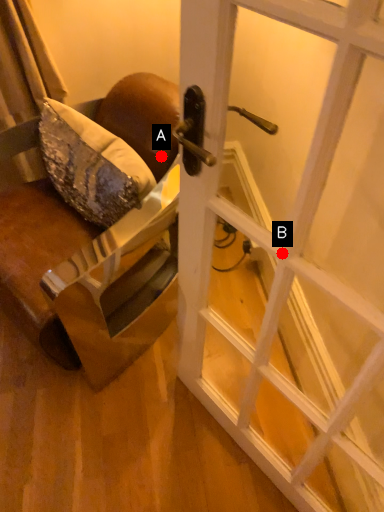
Question: Two points are circled on the image, labeled by A and B beside each circle. Which point appears closest to the camera in this image?

Choices:
 (A) A is closer
 (B) B is closer

Answer: (B)